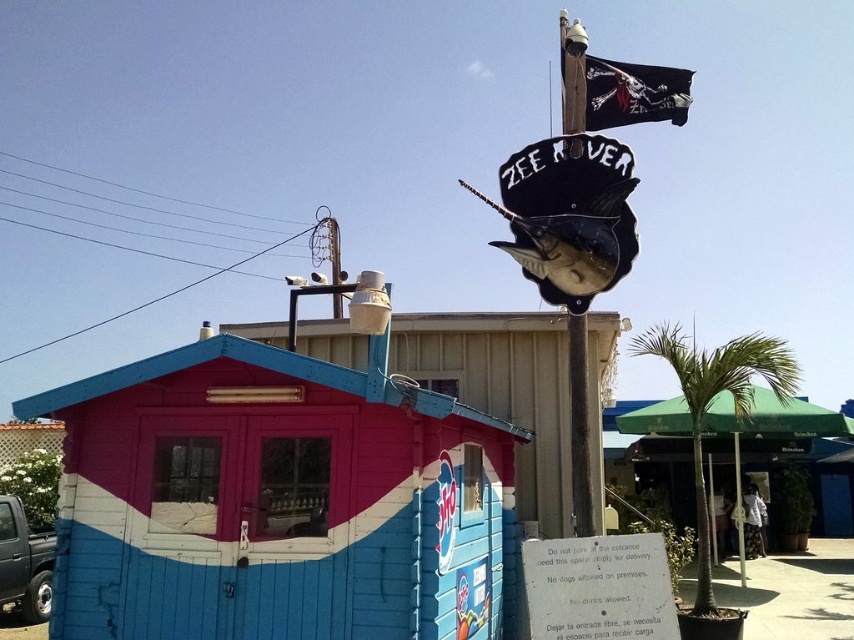
You are at the beach and want to find a shaded spot under the green fabric umbrella at right. Which direction should you walk from the blue painted wood beach hut at lower left?

Walk to the right from the blue painted wood beach hut at lower left to reach the green fabric umbrella at right, since the blue painted wood beach hut at lower left is located to the left of the green fabric umbrella at right.

You are a visitor at the beach and want to take a photo of the blue painted wood beach hut at lower left and the green fabric umbrella at right. Which object should you position closer to the camera to ensure both are in focus?

To ensure both the blue painted wood beach hut at lower left and the green fabric umbrella at right are in focus, position the blue painted wood beach hut at lower left closer to the camera since it is in front of the green fabric umbrella at right.

You are planning to set up a new vendor stall near the blue painted wood beach hut at lower left and the green fabric umbrella at right. Since you want your stall to be more noticeable, which existing object should you place your stall next to and why?

You should place your stall next to the blue painted wood beach hut at lower left because it is larger in size than the green fabric umbrella at right, making it a more prominent landmark for attracting attention.